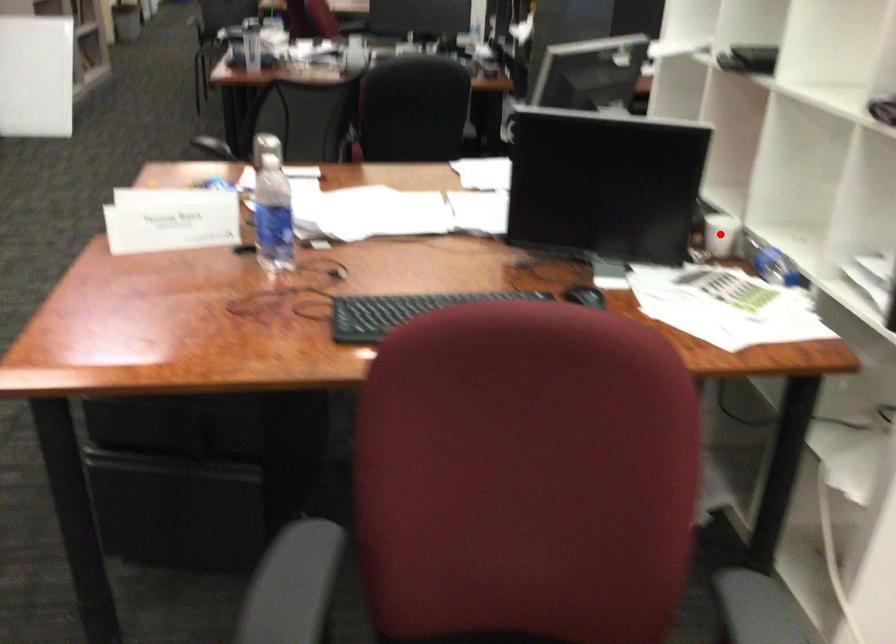
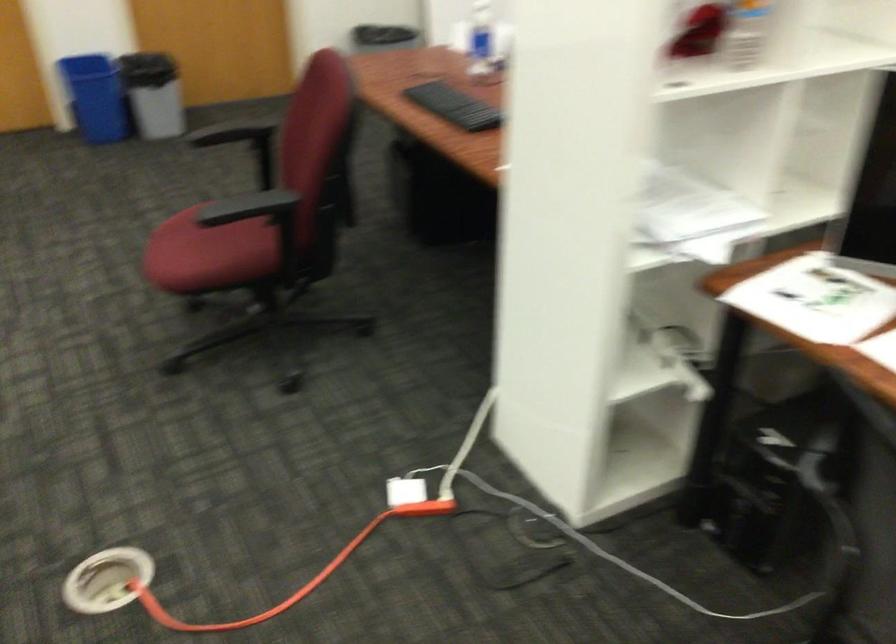
Question: I am providing you with two images of the same scene from different viewpoints. A red point is marked on the first image. Can you still see the location of the red point in image 2?

Choices:
 (A) Yes
 (B) No

Answer: (B)